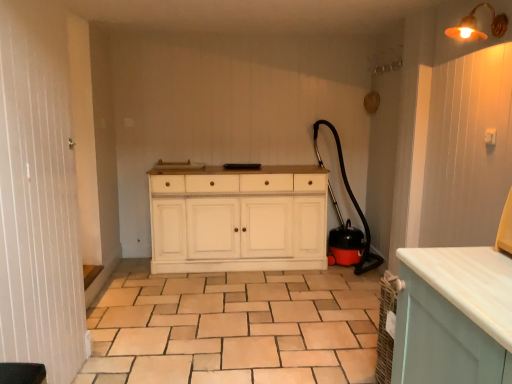
Question: Is metallic brass light fixture at upper right taller or shorter than white wood screen door at left?

Choices:
 (A) short
 (B) tall

Answer: (A)

Question: Is metallic brass light fixture at upper right bigger or smaller than white wood screen door at left?

Choices:
 (A) small
 (B) big

Answer: (A)

Question: Estimate the real-world distances between objects in this image. Which object is closer to the beige ceramic tile at center?

Choices:
 (A) white wood screen door at left
 (B) white wood cabinet at center
 (C) metallic brass light fixture at upper right
 (D) black rubber garden hose at right

Answer: (B)

Question: Which object is the closest to the white wood screen door at left?

Choices:
 (A) black rubber garden hose at right
 (B) metallic brass light fixture at upper right
 (C) white wood cabinet at center
 (D) beige ceramic tile at center

Answer: (D)